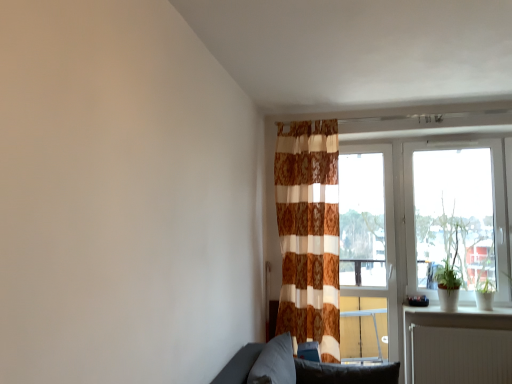
Describe the element at coordinates (456, 313) in the screenshot. Image resolution: width=512 pixels, height=384 pixels. I see `white glossy window sill at lower right` at that location.

Find the location of a particular element. transparent glass window at right is located at coordinates (454, 214).

Describe the element at coordinates (454, 214) in the screenshot. I see `transparent glass window at right` at that location.

I want to click on white glossy window sill at lower right, so click(456, 313).

Is white glossy window sill at lower right facing towards white ribbed radiator at lower right?

No, white glossy window sill at lower right is not turned towards white ribbed radiator at lower right.

Does point (438, 311) come closer to viewer compared to point (483, 347)?

No.

From a real-world perspective, which is physically above, white glossy window sill at lower right or white ribbed radiator at lower right?

In real-world perspective, white glossy window sill at lower right is above.

Is white glossy window sill at lower right not within white ribbed radiator at lower right?

Yes, white glossy window sill at lower right is outside of white ribbed radiator at lower right.

Based on the photo, from the image's perspective, is transparent glass window at right above or below green matte plant at right?

Clearly, from the image's perspective, transparent glass window at right is above green matte plant at right.

Can you tell me how much transparent glass window at right and green matte plant at right differ in facing direction?

They differ by 0.168 degrees in their facing directions.

Which is in front, point (431, 274) or point (440, 270)?

The point (440, 270) is in front.

From their relative heights in the image, would you say transparent glass window at right is taller or shorter than green matte plant at right?

transparent glass window at right is taller than green matte plant at right.

Is dark gray fabric pillow at lower center, which appears as the 2th pillow when viewed from the right, located outside transparent glass window at right?

Absolutely, dark gray fabric pillow at lower center, which appears as the 2th pillow when viewed from the right, is external to transparent glass window at right.

From the image's perspective, is dark gray fabric pillow at lower center, the first pillow positioned from the left, located above or below transparent glass window at right?

From the image's perspective, dark gray fabric pillow at lower center, the first pillow positioned from the left, appears below transparent glass window at right.

Based on the photo, can you confirm if dark gray fabric pillow at lower center, which appears as the 2th pillow when viewed from the right, is shorter than transparent glass window at right?

Yes, dark gray fabric pillow at lower center, which appears as the 2th pillow when viewed from the right, is shorter than transparent glass window at right.

From the picture: Considering the sizes of dark gray fabric pillow at lower center, which appears as the 2th pillow when viewed from the right, and transparent glass window at right in the image, is dark gray fabric pillow at lower center, which appears as the 2th pillow when viewed from the right, bigger or smaller than transparent glass window at right?

dark gray fabric pillow at lower center, which appears as the 2th pillow when viewed from the right, is smaller than transparent glass window at right.

Is dark gray fabric pillow at lower center, which appears as the 2th pillow when viewed from the right, in front of or behind soft gray cushion at lower center, which ranks as the second pillow in left-to-right order, in the image?

Clearly, dark gray fabric pillow at lower center, which appears as the 2th pillow when viewed from the right, is in front of soft gray cushion at lower center, which ranks as the second pillow in left-to-right order.

Considering the sizes of dark gray fabric pillow at lower center, the first pillow positioned from the left, and soft gray cushion at lower center, which ranks as the second pillow in left-to-right order, in the image, is dark gray fabric pillow at lower center, the first pillow positioned from the left, wider or thinner than soft gray cushion at lower center, which ranks as the second pillow in left-to-right order,?

In the image, dark gray fabric pillow at lower center, the first pillow positioned from the left, appears to be more narrow than soft gray cushion at lower center, which ranks as the second pillow in left-to-right order.

Based on the photo, does dark gray fabric pillow at lower center, which appears as the 2th pillow when viewed from the right, have a larger size compared to soft gray cushion at lower center, which ranks as the second pillow in left-to-right order?

Yes, dark gray fabric pillow at lower center, which appears as the 2th pillow when viewed from the right, is bigger than soft gray cushion at lower center, which ranks as the second pillow in left-to-right order.

Would you say dark gray fabric pillow at lower center, the first pillow positioned from the left, is outside soft gray cushion at lower center, which ranks as the second pillow in left-to-right order?

That's correct, dark gray fabric pillow at lower center, the first pillow positioned from the left, is outside of soft gray cushion at lower center, which ranks as the second pillow in left-to-right order.

From the image's perspective, is dark gray fabric pillow at lower center, the first pillow positioned from the left, located above green matte plant at right?

No, from the image's perspective, dark gray fabric pillow at lower center, the first pillow positioned from the left, is not over green matte plant at right.

Which is more to the right, dark gray fabric pillow at lower center, the first pillow positioned from the left, or green matte plant at right?

From the viewer's perspective, green matte plant at right appears more on the right side.

Based on the photo, looking at the image, does dark gray fabric pillow at lower center, the first pillow positioned from the left, seem bigger or smaller compared to green matte plant at right?

In the image, dark gray fabric pillow at lower center, the first pillow positioned from the left, appears to be larger than green matte plant at right.

From the image's perspective, which one is positioned higher, white glossy window sill at lower right or transparent glass window at right?

transparent glass window at right.

Would you say transparent glass window at right is part of white glossy window sill at lower right's contents?

No.

Does white glossy window sill at lower right turn towards transparent glass window at right?

No, white glossy window sill at lower right does not turn towards transparent glass window at right.

Considering the sizes of objects white glossy window sill at lower right and transparent glass window at right in the image provided, who is smaller, white glossy window sill at lower right or transparent glass window at right?

white glossy window sill at lower right is smaller.

From a real-world perspective, count 2nd pillows downward from the brown textured curtain at center and point to it. Please provide its 2D coordinates.

[(345, 373)]

Considering the relative sizes of brown textured curtain at center and soft gray cushion at lower center, which ranks as the second pillow in left-to-right order, in the image provided, is brown textured curtain at center taller than soft gray cushion at lower center, which ranks as the second pillow in left-to-right order,?

Indeed, brown textured curtain at center has a greater height compared to soft gray cushion at lower center, which ranks as the second pillow in left-to-right order.

From the image's perspective, is brown textured curtain at center beneath soft gray cushion at lower center, which ranks as the second pillow in left-to-right order?

No, from the image's perspective, brown textured curtain at center is not beneath soft gray cushion at lower center, which ranks as the second pillow in left-to-right order.

How far apart are brown textured curtain at center and soft gray cushion at lower center, which ranks as the second pillow in left-to-right order?

3.29 feet.

At what (x,y) coordinates should I click in order to perform the action: click on window sill that appears above the white ribbed radiator at lower right (from a real-world perspective). Please return your answer as a coordinate pair (x, y). Looking at the image, I should click on (456, 313).

You are a GUI agent. You are given a task and a screenshot of the screen. Output one action in this format:
    pyautogui.click(x=<x>, y=<y>)
    Task: Click on the plant beneath the transparent glass window at right (from a real-world perspective)
    Image resolution: width=512 pixels, height=384 pixels.
    Given the screenshot: What is the action you would take?
    pyautogui.click(x=450, y=268)

Which object lies further to the anchor point green matte plant at right, dark gray fabric pillow at lower center, which appears as the 2th pillow when viewed from the right, or brown textured curtain at center?

The object further to green matte plant at right is dark gray fabric pillow at lower center, which appears as the 2th pillow when viewed from the right.

Which object lies nearer to the anchor point green matte plant at right, transparent glass window at right or white glossy window sill at lower right?

transparent glass window at right lies closer to green matte plant at right than the other object.

Looking at the image, which one is located further to soft gray cushion at lower center, which ranks as the second pillow in left-to-right order, green matte plant at right or dark gray fabric pillow at lower center, the first pillow positioned from the left?

Result: Based on the image, green matte plant at right appears to be further to soft gray cushion at lower center, which ranks as the second pillow in left-to-right order.

Which object lies nearer to the anchor point green matte plant at right, white glossy window sill at lower right or soft gray cushion at lower center, arranged as the 1th pillow when viewed from the right?

white glossy window sill at lower right lies closer to green matte plant at right than the other object.

Estimate the real-world distances between objects in this image. Which object is further from soft gray cushion at lower center, arranged as the 1th pillow when viewed from the right, brown textured curtain at center or green matte plant at right?

green matte plant at right is positioned further to the anchor soft gray cushion at lower center, arranged as the 1th pillow when viewed from the right.

Estimate the real-world distances between objects in this image. Which object is closer to white ribbed radiator at lower right, transparent glass window at right or brown textured curtain at center?

transparent glass window at right is positioned closer to the anchor white ribbed radiator at lower right.

Considering their positions, is soft gray cushion at lower center, which ranks as the second pillow in left-to-right order, positioned further to green matte plant at right than brown textured curtain at center?

The object further to green matte plant at right is soft gray cushion at lower center, which ranks as the second pillow in left-to-right order.

Based on the photo, estimate the real-world distances between objects in this image. Which object is closer to white glossy window sill at lower right, soft gray cushion at lower center, arranged as the 1th pillow when viewed from the right, or transparent glass window at right?

Based on the image, transparent glass window at right appears to be nearer to white glossy window sill at lower right.

You are a GUI agent. You are given a task and a screenshot of the screen. Output one action in this format:
    pyautogui.click(x=<x>, y=<y>)
    Task: Click on the plant between brown textured curtain at center and white ribbed radiator at lower right from left to right
    
    Given the screenshot: What is the action you would take?
    pyautogui.click(x=450, y=268)

Identify the location of plant between dark gray fabric pillow at lower center, which appears as the 2th pillow when viewed from the right, and transparent glass window at right. The height and width of the screenshot is (384, 512). (450, 268).

What are the coordinates of `plant between dark gray fabric pillow at lower center, the first pillow positioned from the left, and white ribbed radiator at lower right, in the horizontal direction` in the screenshot? It's located at (450, 268).

The image size is (512, 384). Find the location of `plant located between brown textured curtain at center and white glossy window sill at lower right in the left-right direction`. plant located between brown textured curtain at center and white glossy window sill at lower right in the left-right direction is located at coordinates (450, 268).